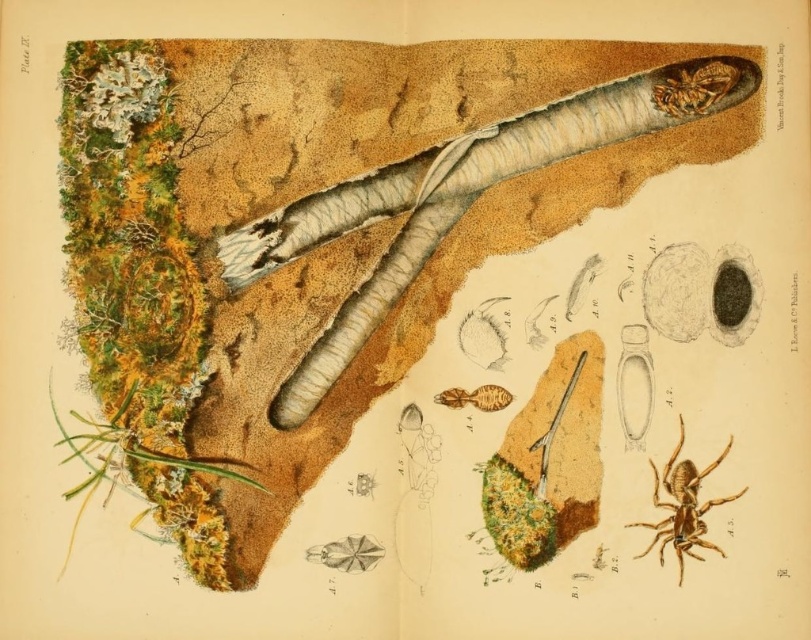
Question: Which point is closer to the camera taking this photo?

Choices:
 (A) (694, 102)
 (B) (462, 403)
 (C) (350, 314)

Answer: (B)

Question: Is white textured worm at center bigger than brown matte spider at center?

Choices:
 (A) yes
 (B) no

Answer: (A)

Question: Which object appears closest to the camera in this image?

Choices:
 (A) white textured worm at center
 (B) shiny brown beetle at upper right

Answer: (A)

Question: Is brown matte spider at center further to the viewer compared to shiny brown beetle at upper right?

Choices:
 (A) no
 (B) yes

Answer: (A)

Question: Where is white textured worm at center located in relation to brown matte spider at center in the image?

Choices:
 (A) left
 (B) right

Answer: (A)

Question: Which point is farther to the camera?

Choices:
 (A) (526, 113)
 (B) (492, 388)

Answer: (A)